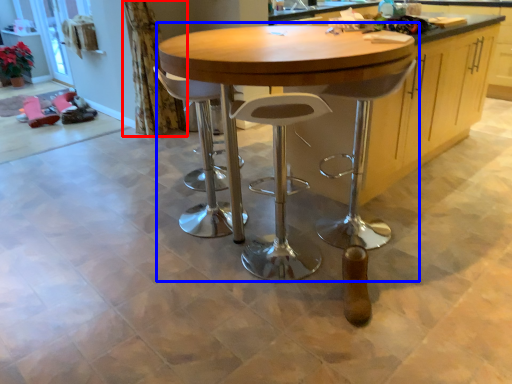
Question: Which of the following is the farthest to the observer, curtain (highlighted by a red box) or table (highlighted by a blue box)?

Choices:
 (A) curtain
 (B) table

Answer: (A)